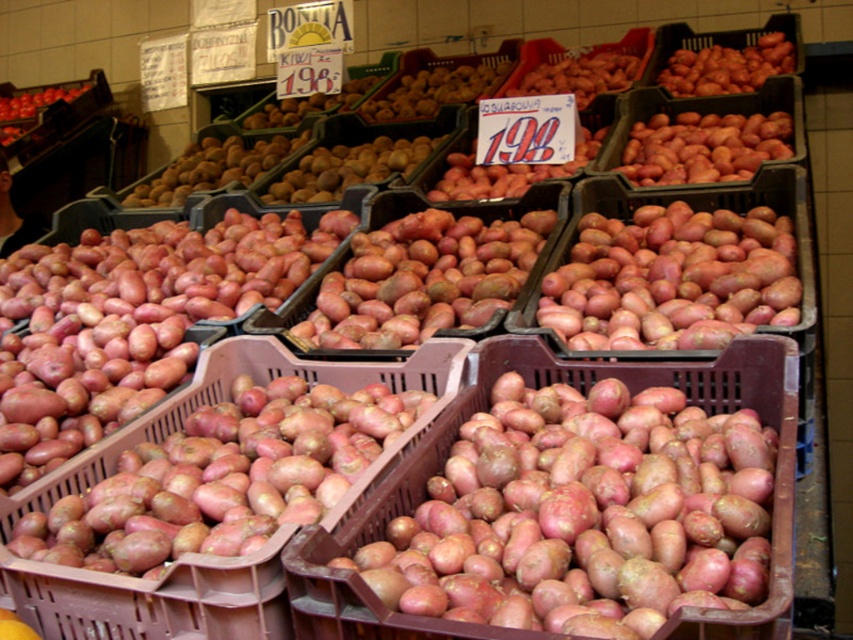
Question: Which point is closer to the camera?

Choices:
 (A) (758, 566)
 (B) (577, 307)
 (C) (335, 449)
 (D) (706, 64)

Answer: (A)

Question: Does smooth red potatoes at center appear over red matte potato at center?

Choices:
 (A) yes
 (B) no

Answer: (B)

Question: Can you confirm if smooth red potatoes at center is thinner than matte red potato at center?

Choices:
 (A) yes
 (B) no

Answer: (B)

Question: Which point appears farthest from the camera in this image?

Choices:
 (A) (434, 609)
 (B) (569, 260)
 (C) (328, 476)
 (D) (735, 84)

Answer: (D)

Question: Does matte red potato at center come in front of matte red potato at upper right?

Choices:
 (A) yes
 (B) no

Answer: (A)

Question: Among these points, which one is farthest from the camera?

Choices:
 (A) (733, 451)
 (B) (740, 248)

Answer: (B)